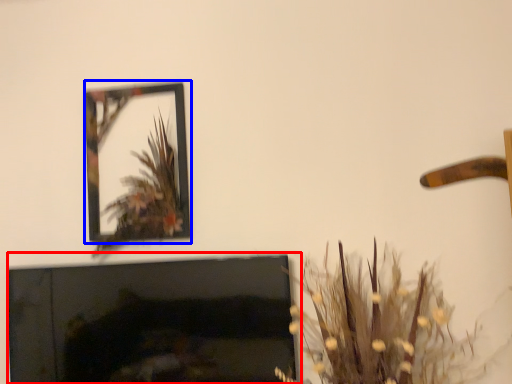
Question: Which of the following is the farthest to the observer, fireplace (highlighted by a red box) or picture frame (highlighted by a blue box)?

Choices:
 (A) fireplace
 (B) picture frame

Answer: (B)